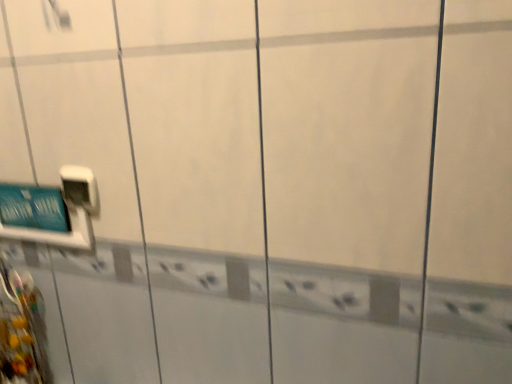
Locate an element on the screen. The height and width of the screenshot is (384, 512). white plastic light switch at upper left is located at coordinates (80, 188).

What is the approximate height of white plastic light switch at upper left?

white plastic light switch at upper left is 3.31 inches in height.

This screenshot has height=384, width=512. Describe the element at coordinates (80, 188) in the screenshot. I see `white plastic light switch at upper left` at that location.

In order to face white plastic light switch at upper left, should I rotate leftwards or rightwards?

You should rotate left by 22.241 degrees.

This screenshot has height=384, width=512. I want to click on white plastic light switch at upper left, so click(80, 188).